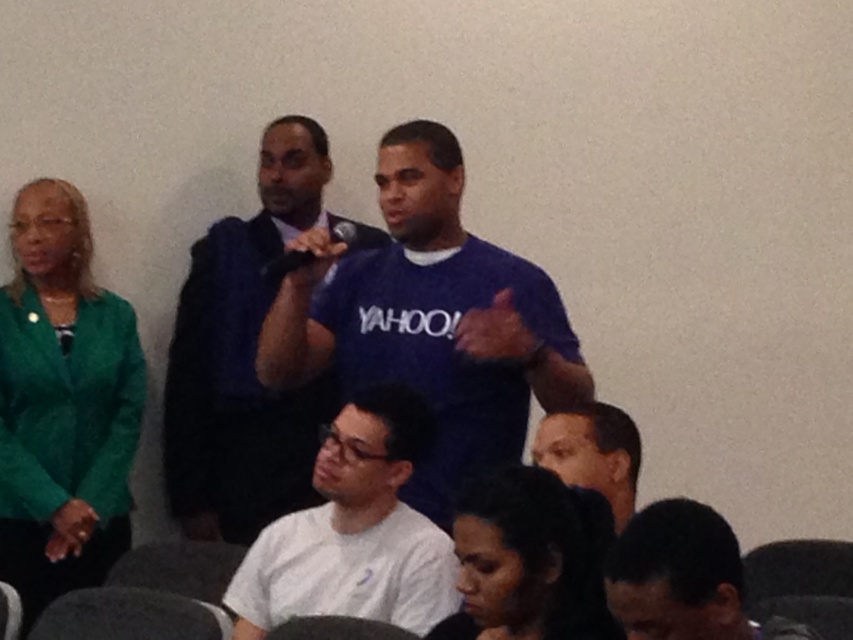
Question: Which object appears farthest from the camera in this image?

Choices:
 (A) matte blue shirt at center
 (B) white matte shirt at lower center
 (C) blue fabric shirt at center

Answer: (C)

Question: Can you confirm if matte blue shirt at center is wider than dark blue shirt at lower right?

Choices:
 (A) no
 (B) yes

Answer: (B)

Question: Based on their relative distances, which object is farther from the smooth skin face at lower center?

Choices:
 (A) blue fabric shirt at center
 (B) dark blue shirt at lower right

Answer: (A)

Question: Can you confirm if matte blue shirt at center is positioned to the left of smooth skin face at lower center?

Choices:
 (A) yes
 (B) no

Answer: (A)

Question: Can you confirm if matte blue shirt at center is positioned above smooth skin face at lower center?

Choices:
 (A) no
 (B) yes

Answer: (B)

Question: Which point is closer to the camera?

Choices:
 (A) matte blue shirt at center
 (B) blue fabric shirt at center
 (C) white matte shirt at lower center

Answer: (C)